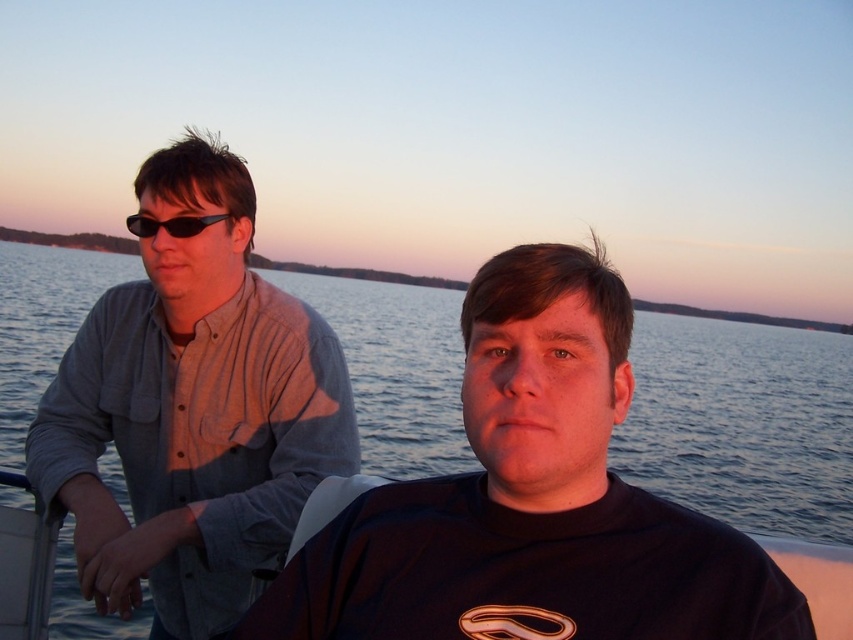
Question: Does black matte shirt at center have a smaller size compared to black fabric boat at lower center?

Choices:
 (A) no
 (B) yes

Answer: (A)

Question: Which object is the farthest from the matte gray shirt at left?

Choices:
 (A) black matte shirt at center
 (B) black plastic sunglasses at upper left
 (C) black fabric boat at lower center

Answer: (A)

Question: Which of these objects is positioned closest to the black fabric boat at lower center?

Choices:
 (A) matte gray shirt at left
 (B) black matte shirt at center

Answer: (A)

Question: Estimate the real-world distances between objects in this image. Which object is closer to the black fabric boat at lower center?

Choices:
 (A) black plastic sunglasses at upper left
 (B) matte gray shirt at left
 (C) black matte shirt at center

Answer: (B)

Question: Can you confirm if black matte shirt at center is positioned above black plastic sunglasses at upper left?

Choices:
 (A) no
 (B) yes

Answer: (A)

Question: Can you confirm if black matte shirt at center is thinner than black fabric boat at lower center?

Choices:
 (A) yes
 (B) no

Answer: (B)